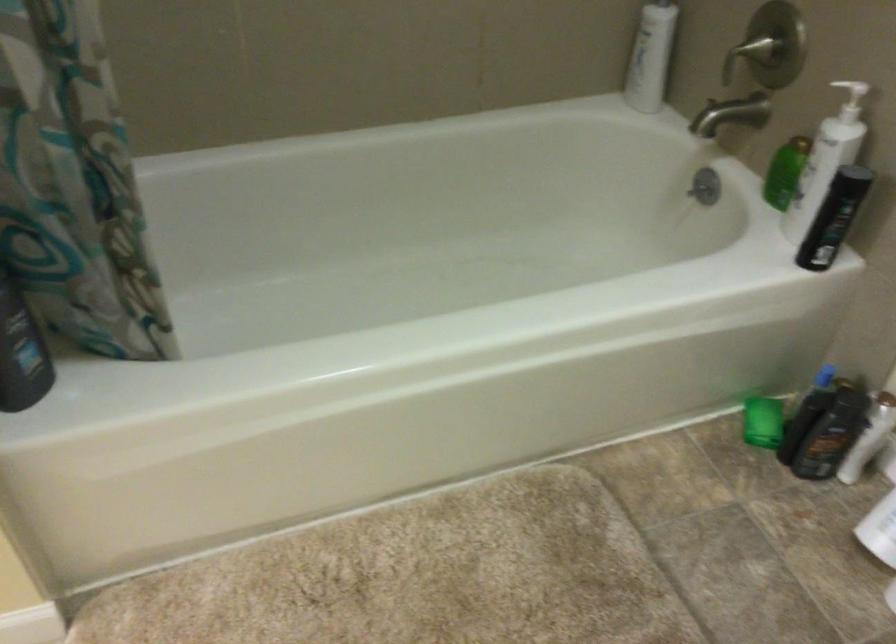
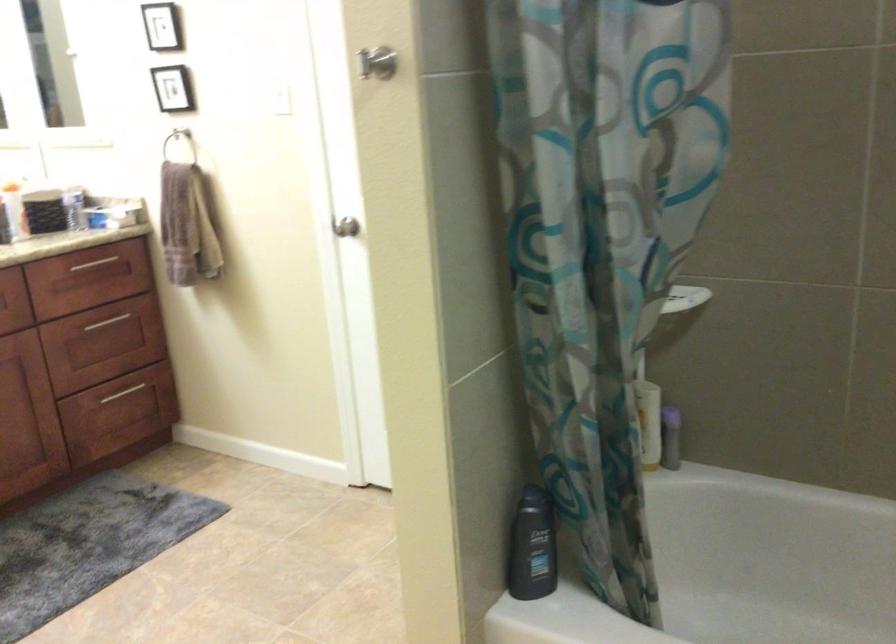
Question: The first image is from the beginning of the video and the second image is from the end. How did the camera likely rotate when shooting the video?

Choices:
 (A) Left
 (B) Right
 (C) Up
 (D) Down

Answer: (A)